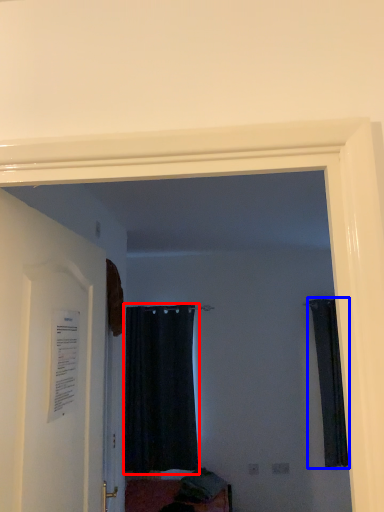
Question: Which point is further to the camera, curtain (highlighted by a red box) or curtain (highlighted by a blue box)?

Choices:
 (A) curtain
 (B) curtain

Answer: (A)